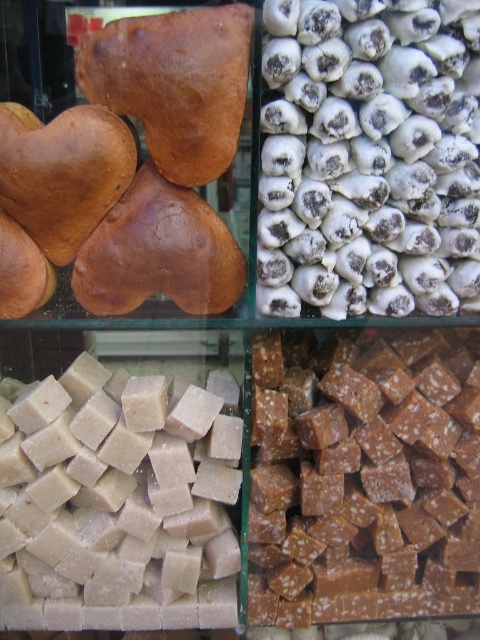
Question: Which point is closer to the camera?

Choices:
 (A) (424, 372)
 (B) (217, 541)

Answer: (A)

Question: Does white sugary cubes at bottom left have a smaller size compared to matte brown heart-shaped bread at upper left?

Choices:
 (A) no
 (B) yes

Answer: (A)

Question: Where is caramelized sugar cubes at center located in relation to white sugary cubes at bottom left in the image?

Choices:
 (A) below
 (B) above

Answer: (B)

Question: Can you confirm if white sugary cubes at bottom left is smaller than matte brown heart-shaped bread at upper left?

Choices:
 (A) yes
 (B) no

Answer: (B)

Question: Among these points, which one is nearest to the camera?

Choices:
 (A) pyautogui.click(x=264, y=369)
 (B) pyautogui.click(x=321, y=58)

Answer: (B)

Question: Which object is farther from the camera taking this photo?

Choices:
 (A) caramelized sugar cubes at center
 (B) matte brown heart-shaped bread at upper left
 (C) white sugared candy at upper right
 (D) white sugary cubes at bottom left

Answer: (A)